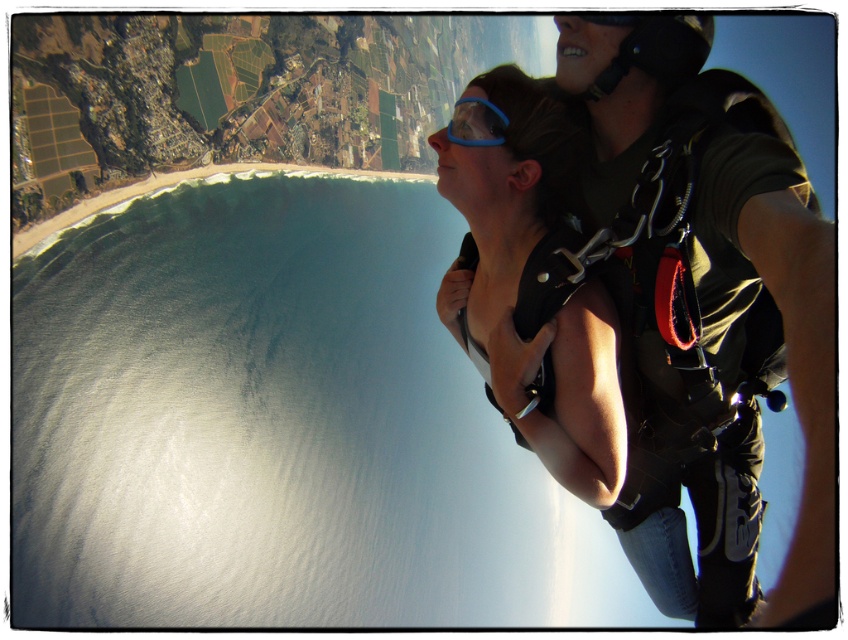
Question: Is matte black harness at center positioned behind blue rubber goggles at center?

Choices:
 (A) no
 (B) yes

Answer: (A)

Question: Among these objects, which one is nearest to the camera?

Choices:
 (A) matte black harness at center
 (B) blue rubber goggles at center

Answer: (A)

Question: Is matte black harness at center behind blue rubber goggles at center?

Choices:
 (A) yes
 (B) no

Answer: (B)

Question: Does matte black harness at center lie behind blue rubber goggles at center?

Choices:
 (A) no
 (B) yes

Answer: (A)